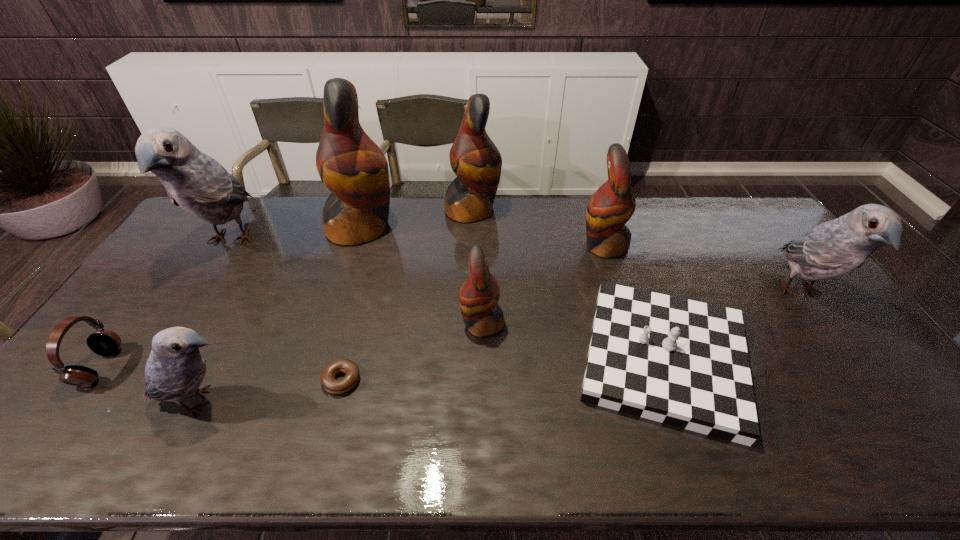
Identify the location of the fifth parrot from right to left. The height and width of the screenshot is (540, 960). (350, 164).

Where is `the biggest red parrot`? The height and width of the screenshot is (540, 960). the biggest red parrot is located at coordinates (350, 164).

At what (x,y) coordinates should I click in order to perform the action: click on the third smallest red parrot. Please return your answer as a coordinate pair (x, y). Image resolution: width=960 pixels, height=540 pixels. Looking at the image, I should click on (474, 158).

Identify the location of the biggest gray parrot. The height and width of the screenshot is (540, 960). (199, 184).

The width and height of the screenshot is (960, 540). In order to click on the second smallest red parrot in this screenshot , I will do `click(610, 207)`.

At what (x,y) coordinates should I click in order to perform the action: click on the second parrot from right to left. Please return your answer as a coordinate pair (x, y). The width and height of the screenshot is (960, 540). Looking at the image, I should click on (610, 207).

Identify the location of the second smallest gray parrot. The width and height of the screenshot is (960, 540). (836, 247).

Find the location of a particular element. the rightmost gray parrot is located at coordinates (836, 247).

Locate an element on the screen. Image resolution: width=960 pixels, height=540 pixels. the smallest gray parrot is located at coordinates (175, 369).

This screenshot has height=540, width=960. I want to click on the nearest parrot, so click(175, 369).